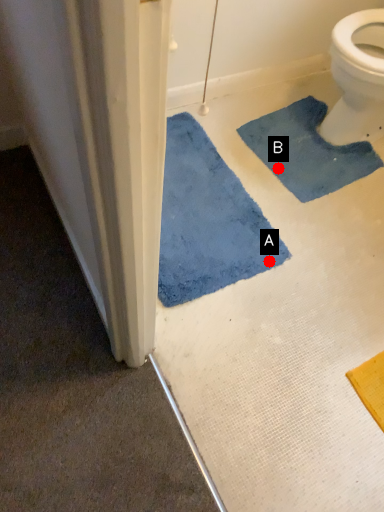
Question: Two points are circled on the image, labeled by A and B beside each circle. Which point is closer to the camera?

Choices:
 (A) A is closer
 (B) B is closer

Answer: (A)